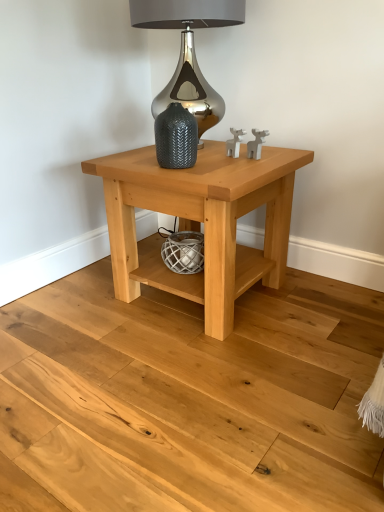
Find the location of a particular element. vacant space in front of natural wood table at center is located at coordinates (198, 381).